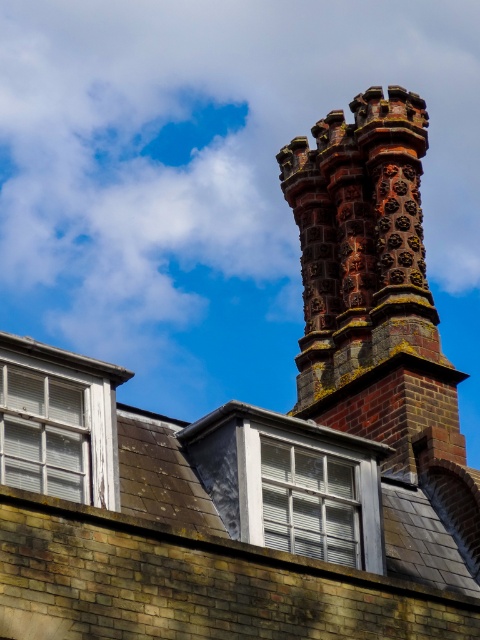
Which is more to the right, brown shingles at upper center or rustic brick chimney at upper center?

rustic brick chimney at upper center

Who is positioned more to the left, brown shingles at upper center or rustic brick chimney at upper center?

brown shingles at upper center

Find the location of `brown shingles at upper center`. brown shingles at upper center is located at coordinates coord(235,486).

Who is lower down, brown shingles at upper center or clear glass window at center?

clear glass window at center

Between brown shingles at upper center and clear glass window at center, which one is positioned higher?

brown shingles at upper center

Does point (445, 595) lie behind point (348, 486)?

No.

What are the coordinates of `brown shingles at upper center` in the screenshot? It's located at (235, 486).

How distant is rustic brick chimney at upper center from white wooden window at upper left?

rustic brick chimney at upper center and white wooden window at upper left are 15.02 meters apart.

From the picture: Is rustic brick chimney at upper center further to the viewer compared to white wooden window at upper left?

Yes, rustic brick chimney at upper center is further from the viewer.

Image resolution: width=480 pixels, height=640 pixels. Identify the location of rustic brick chimney at upper center. (369, 275).